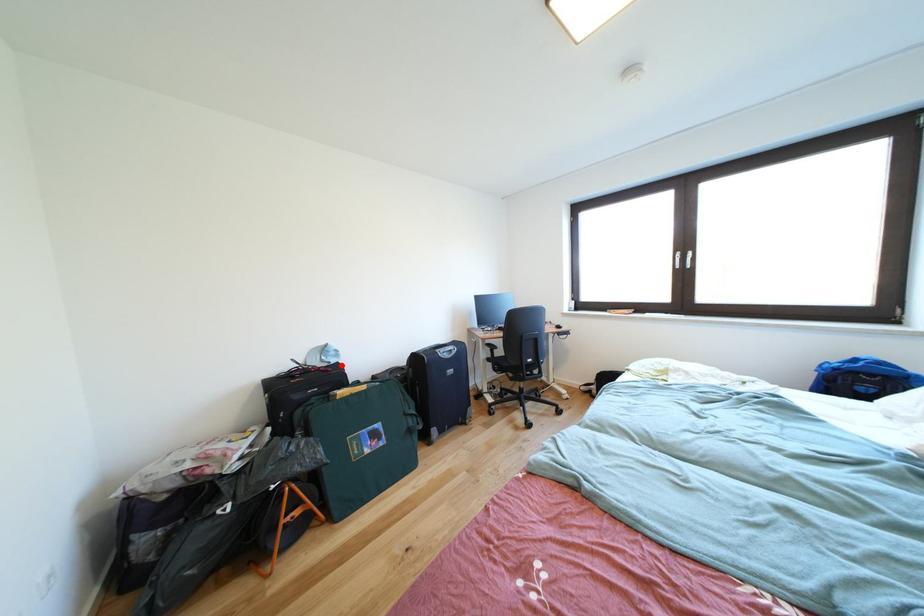
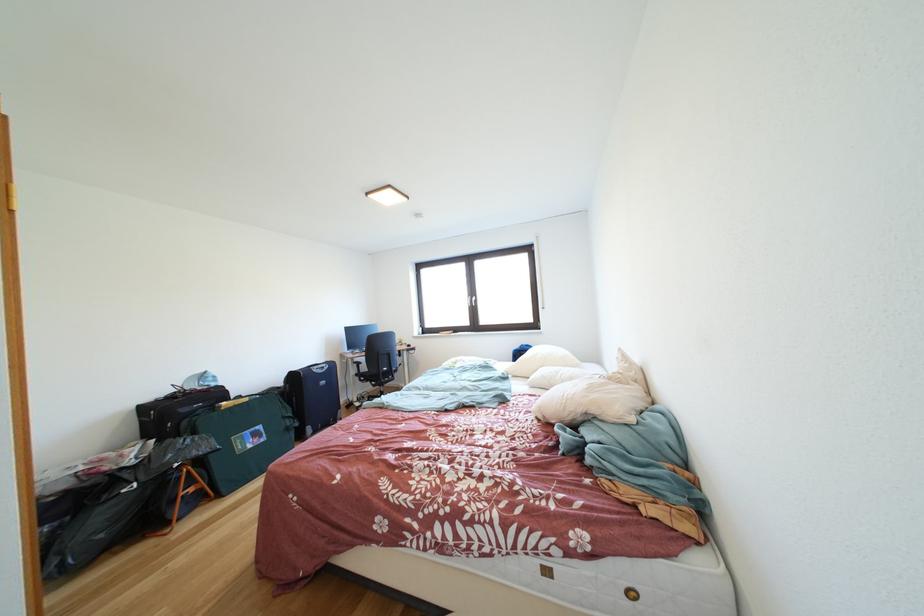
In the second image, find the point that corresponds to the highlighted location in the first image.

(222, 389)